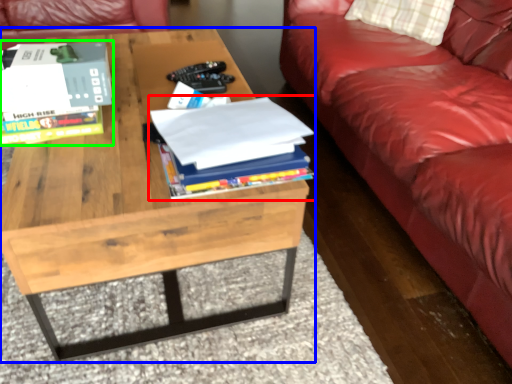
Question: Considering the real-world distances, which object is farthest from book (highlighted by a red box)? coffee table (highlighted by a blue box) or book (highlighted by a green box)?

Choices:
 (A) coffee table
 (B) book

Answer: (B)